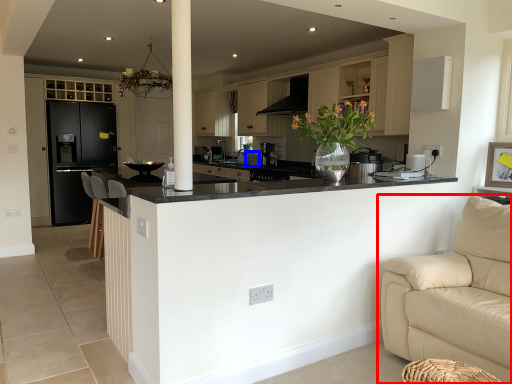
Question: Which of the following is the farthest to the observer, studio couch (highlighted by a red box) or appliance (highlighted by a blue box)?

Choices:
 (A) studio couch
 (B) appliance

Answer: (B)